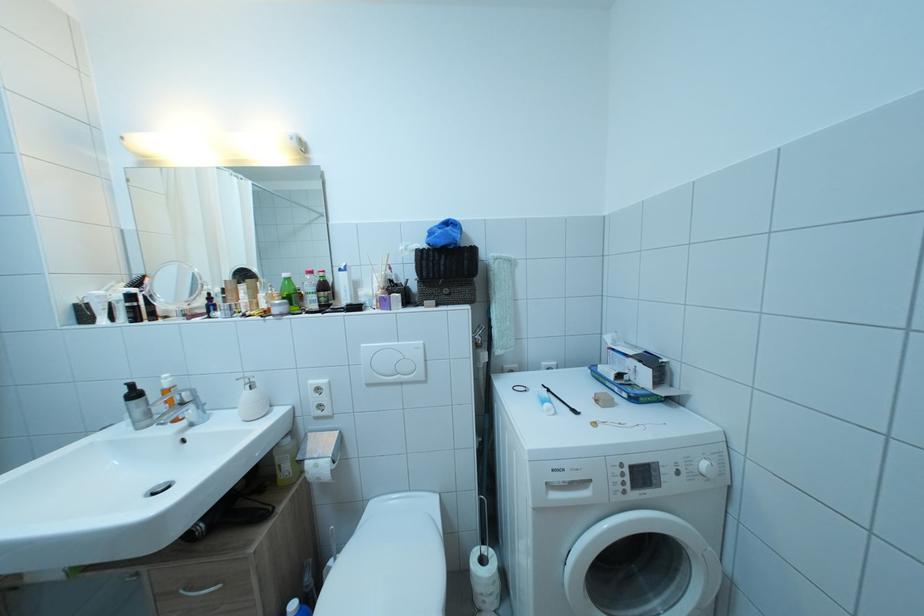
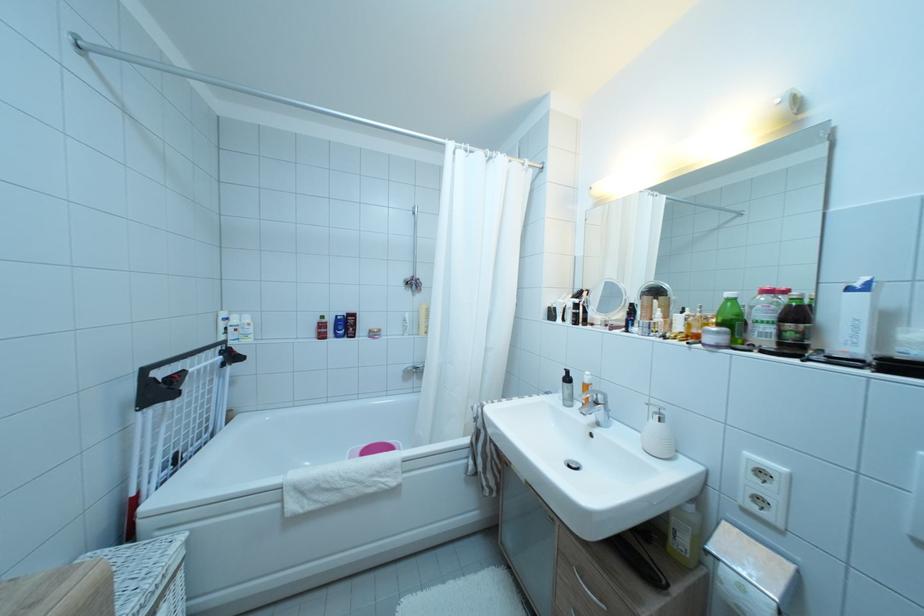
Where in the second image is the point corresponding to (309,302) from the first image?

(754, 330)